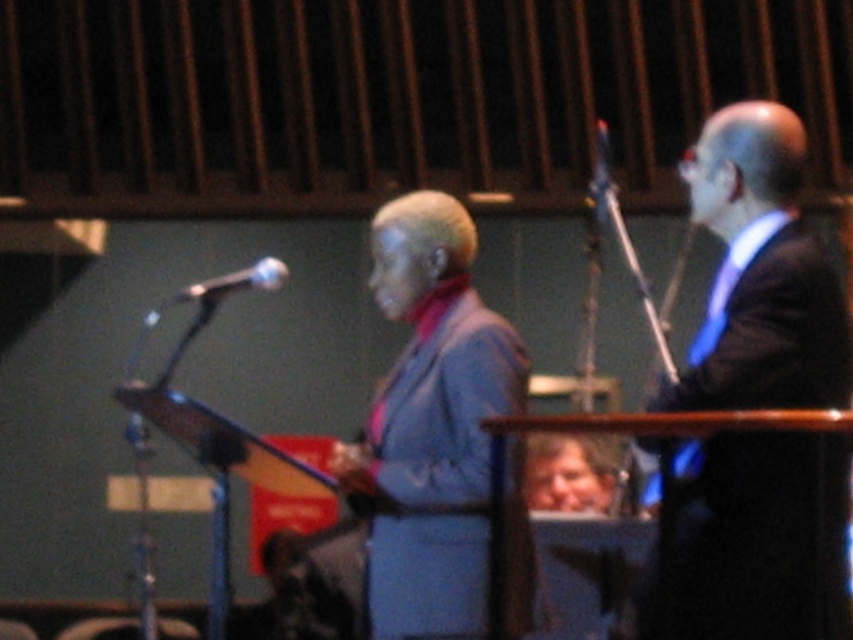
Which is below, dark blue suit at right or matte silver microphone at left?

Positioned lower is dark blue suit at right.

Does dark blue suit at right appear on the left side of matte silver microphone at left?

In fact, dark blue suit at right is to the right of matte silver microphone at left.

Is point (796, 435) less distant than point (252, 288)?

Yes, it is in front of point (252, 288).

You are a GUI agent. You are given a task and a screenshot of the screen. Output one action in this format:
    pyautogui.click(x=<x>, y=<y>)
    Task: Click on the dark blue suit at right
    The height and width of the screenshot is (640, 853).
    Given the screenshot: What is the action you would take?
    pyautogui.click(x=759, y=275)

Is dark blue suit at right positioned behind matte blue suit at center?

No, dark blue suit at right is in front of matte blue suit at center.

Who is lower down, dark blue suit at right or matte blue suit at center?

Positioned lower is matte blue suit at center.

Who is more forward, (706, 129) or (350, 481)?

Point (706, 129) is in front.

I want to click on dark blue suit at right, so click(x=759, y=275).

Is matte blue suit at center closer to the viewer compared to matte silver microphone at left?

Yes.

Consider the image. Can you confirm if matte blue suit at center is shorter than matte silver microphone at left?

No, matte blue suit at center is not shorter than matte silver microphone at left.

The image size is (853, 640). Identify the location of matte blue suit at center. (432, 362).